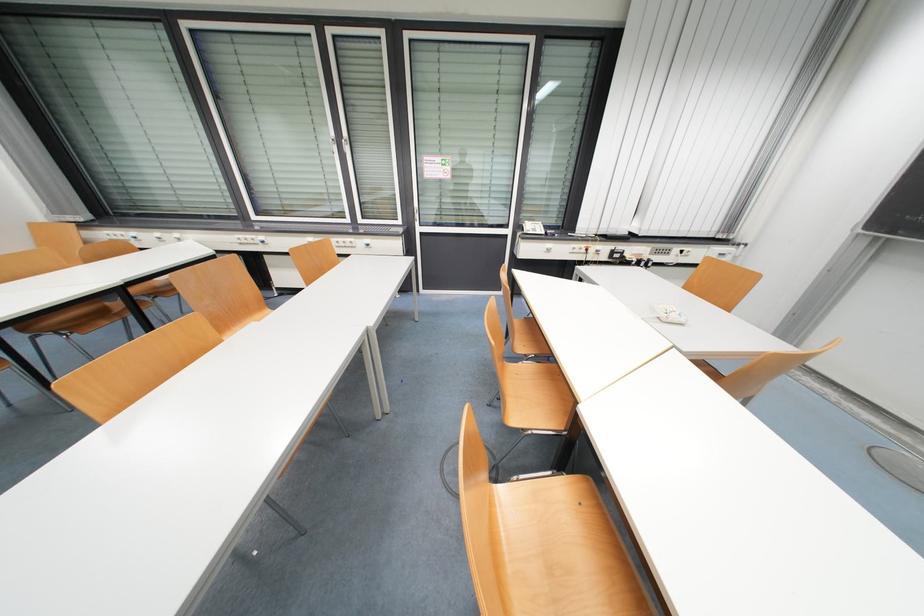
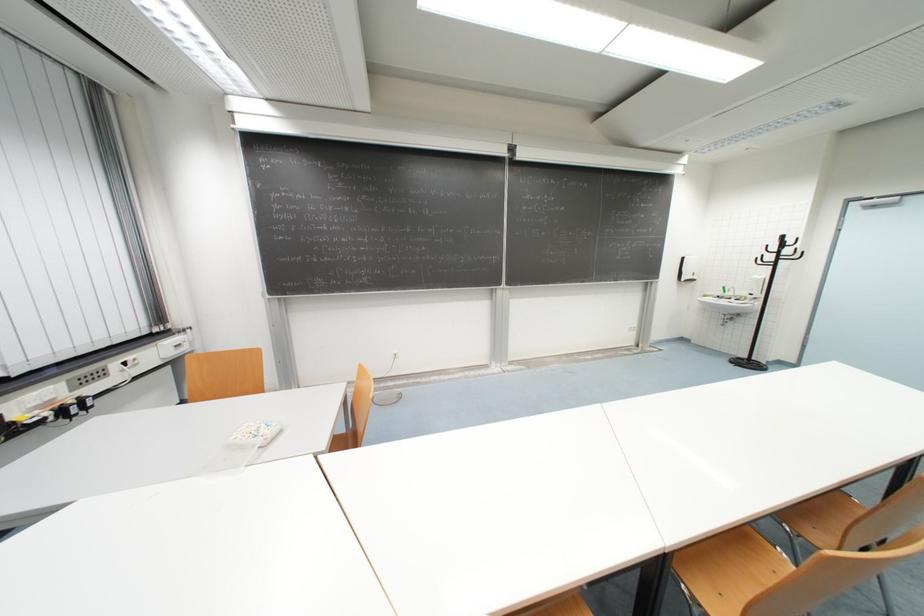
The images are taken continuously from a first-person perspective. In which direction is your viewpoint rotating?

The camera rotated toward right-down.